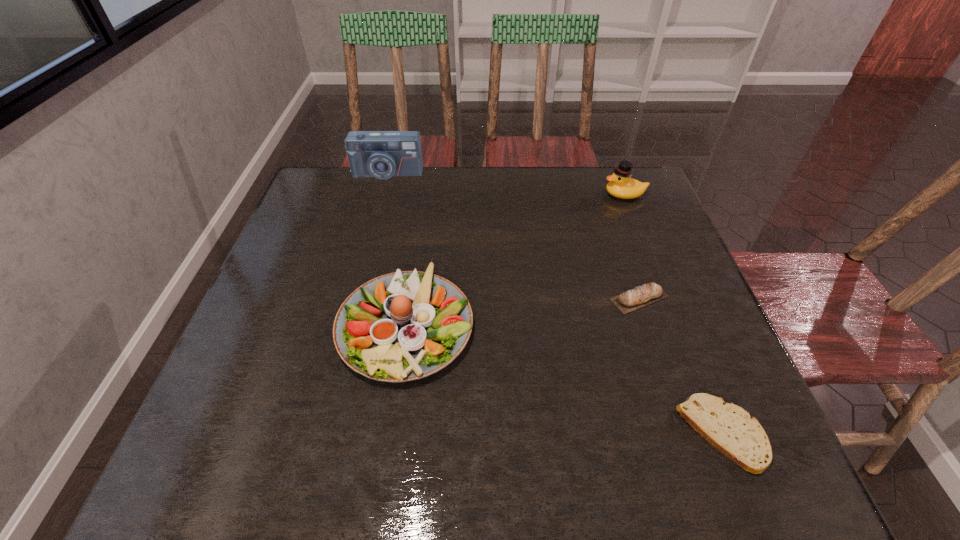
Where is `the tallest object`? The height and width of the screenshot is (540, 960). the tallest object is located at coordinates (381, 154).

Find the location of a particular element. This screenshot has height=540, width=960. camera is located at coordinates (381, 154).

Locate an element on the screen. the fourth nearest object is located at coordinates (621, 185).

Locate an element on the screen. salad plate is located at coordinates (403, 326).

Identify the location of the fourth tallest object. click(x=648, y=293).

This screenshot has width=960, height=540. In order to click on the farther pita bread in this screenshot , I will do `click(648, 293)`.

Where is `the shortest object`? The image size is (960, 540). the shortest object is located at coordinates (729, 428).

At what (x,y) coordinates should I click in order to perform the action: click on the nearest object. Please return your answer as a coordinate pair (x, y). The width and height of the screenshot is (960, 540). Looking at the image, I should click on (729, 428).

Identify the location of free location located 0.150m on the lens of the tallest object. The image size is (960, 540). (376, 212).

Locate an element on the screen. Image resolution: width=960 pixels, height=540 pixels. free space located on the front-facing side of the duck is located at coordinates (579, 195).